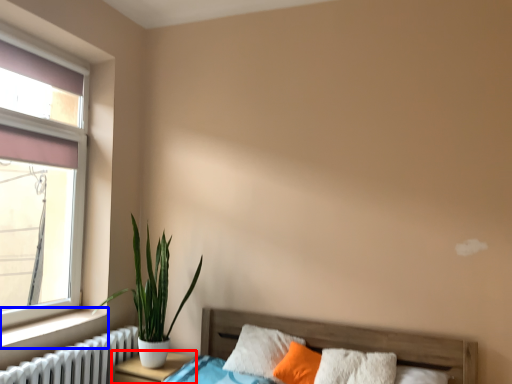
Question: Which of the following is the closest to the observer, nightstand (highlighted by a red box) or window sill (highlighted by a blue box)?

Choices:
 (A) nightstand
 (B) window sill

Answer: (B)